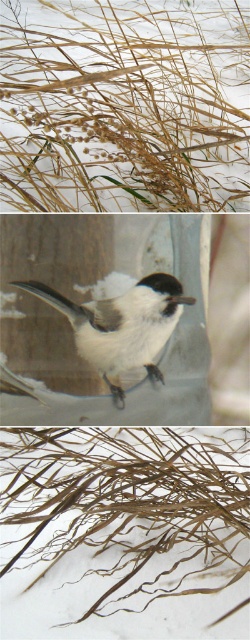
Question: Considering the relative positions of golden straw grass at upper center and white matte bird at center in the image provided, where is golden straw grass at upper center located with respect to white matte bird at center?

Choices:
 (A) right
 (B) left

Answer: (B)

Question: Can you confirm if brown dry reed at lower center is smaller than white matte bird at center?

Choices:
 (A) yes
 (B) no

Answer: (B)

Question: Which object is the farthest from the golden straw grass at upper center?

Choices:
 (A) brown dry reed at lower center
 (B) white matte bird at center

Answer: (B)

Question: Which of the following is the closest to the observer?

Choices:
 (A) (163, 12)
 (B) (171, 314)
 (C) (204, 589)

Answer: (B)

Question: Estimate the real-world distances between objects in this image. Which object is closer to the white matte bird at center?

Choices:
 (A) brown dry reed at lower center
 (B) golden straw grass at upper center

Answer: (A)

Question: Is golden straw grass at upper center smaller than brown dry reed at lower center?

Choices:
 (A) yes
 (B) no

Answer: (B)